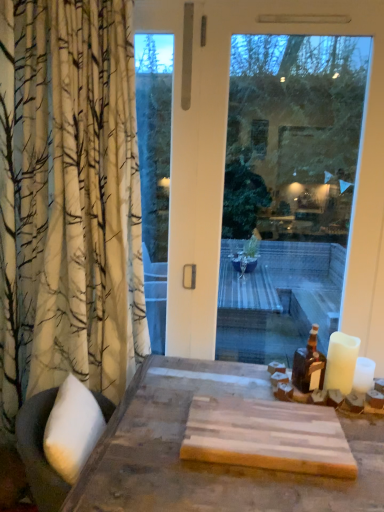
Question: Would you say brown glass bottle at right is part of transparent glass window at center's contents?

Choices:
 (A) yes
 (B) no

Answer: (B)

Question: Considering the relative positions of transparent glass window at center and brown glass bottle at right in the image provided, is transparent glass window at center in front of brown glass bottle at right?

Choices:
 (A) yes
 (B) no

Answer: (B)

Question: From a real-world perspective, is transparent glass window at center on top of brown glass bottle at right?

Choices:
 (A) yes
 (B) no

Answer: (A)

Question: Is transparent glass window at center facing away from brown glass bottle at right?

Choices:
 (A) yes
 (B) no

Answer: (A)

Question: Is transparent glass window at center in contact with brown glass bottle at right?

Choices:
 (A) yes
 (B) no

Answer: (B)

Question: Based on their positions, is transparent glass window at center located to the left or right of brown glass bottle at right?

Choices:
 (A) left
 (B) right

Answer: (A)

Question: In terms of width, does transparent glass window at center look wider or thinner when compared to brown glass bottle at right?

Choices:
 (A) thin
 (B) wide

Answer: (A)

Question: In the image, is transparent glass window at center positioned in front of or behind brown glass bottle at right?

Choices:
 (A) front
 (B) behind

Answer: (B)

Question: Does point (178, 51) appear closer or farther from the camera than point (302, 356)?

Choices:
 (A) closer
 (B) farther

Answer: (A)

Question: From a real-world perspective, is white matte candle at right positioned above or below transparent glass window at center?

Choices:
 (A) below
 (B) above

Answer: (A)

Question: Considering the positions of white matte candle at right and transparent glass window at center in the image, is white matte candle at right bigger or smaller than transparent glass window at center?

Choices:
 (A) small
 (B) big

Answer: (A)

Question: Considering the positions of point (352, 370) and point (365, 7), is point (352, 370) closer or farther from the camera than point (365, 7)?

Choices:
 (A) closer
 (B) farther

Answer: (A)

Question: Considering the positions of white matte candle at right and transparent glass window at center in the image, is white matte candle at right taller or shorter than transparent glass window at center?

Choices:
 (A) tall
 (B) short

Answer: (B)

Question: Relative to white matte candle at right, is brown glass bottle at right in front or behind?

Choices:
 (A) behind
 (B) front

Answer: (A)

Question: Is brown glass bottle at right inside or outside of white matte candle at right?

Choices:
 (A) inside
 (B) outside

Answer: (B)